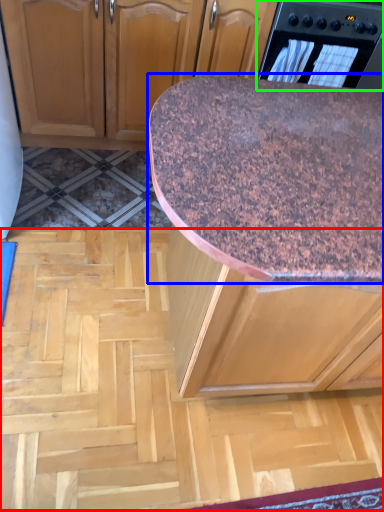
Question: Which object is positioned closest to plywood (highlighted by a red box)? Select from countertop (highlighted by a blue box) and home appliance (highlighted by a green box).

Choices:
 (A) countertop
 (B) home appliance

Answer: (A)